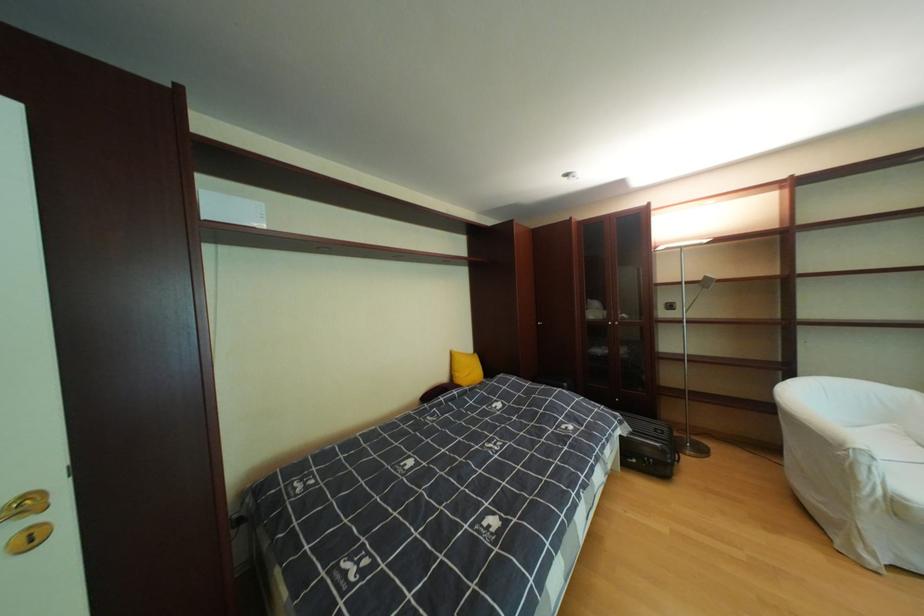
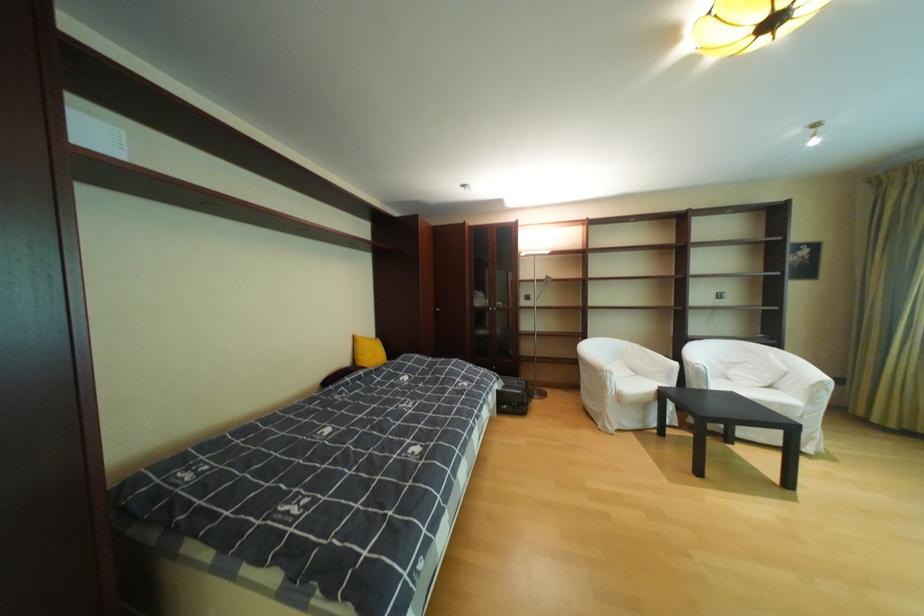
Where in the second image is the point corresponding to (876,461) from the first image?

(621, 377)